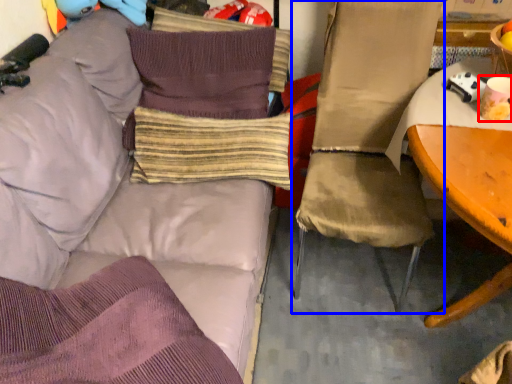
Question: Which object appears closest to the camera in this image, coffee cup (highlighted by a red box) or chair (highlighted by a blue box)?

Choices:
 (A) coffee cup
 (B) chair

Answer: (B)